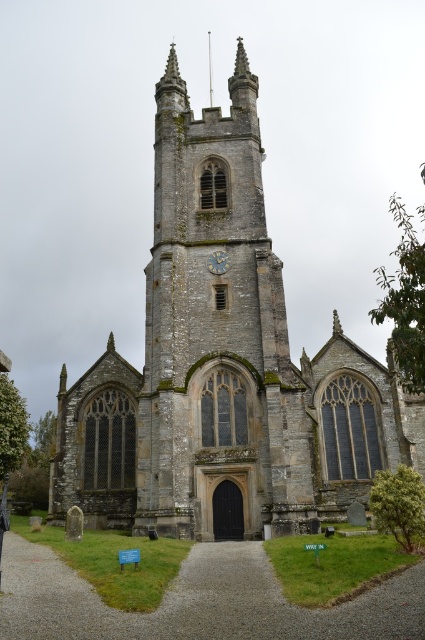
Does stone church at center have a smaller size compared to gold textured clock at center?

No.

Locate an element on the screen. This screenshot has width=425, height=640. stone church at center is located at coordinates (223, 365).

The width and height of the screenshot is (425, 640). What do you see at coordinates (223, 365) in the screenshot?
I see `stone church at center` at bounding box center [223, 365].

Locate an element on the screen. stone church at center is located at coordinates (223, 365).